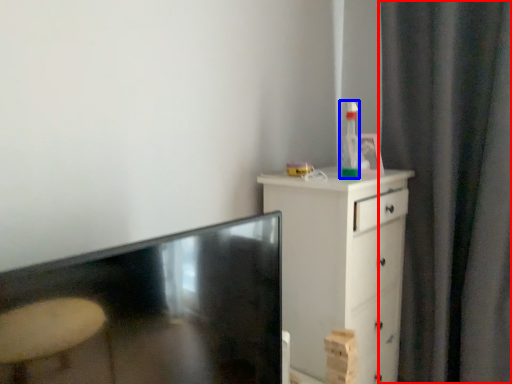
Question: Which of the following is the farthest to the observer, curtain (highlighted by a red box) or bottle (highlighted by a blue box)?

Choices:
 (A) curtain
 (B) bottle

Answer: (B)